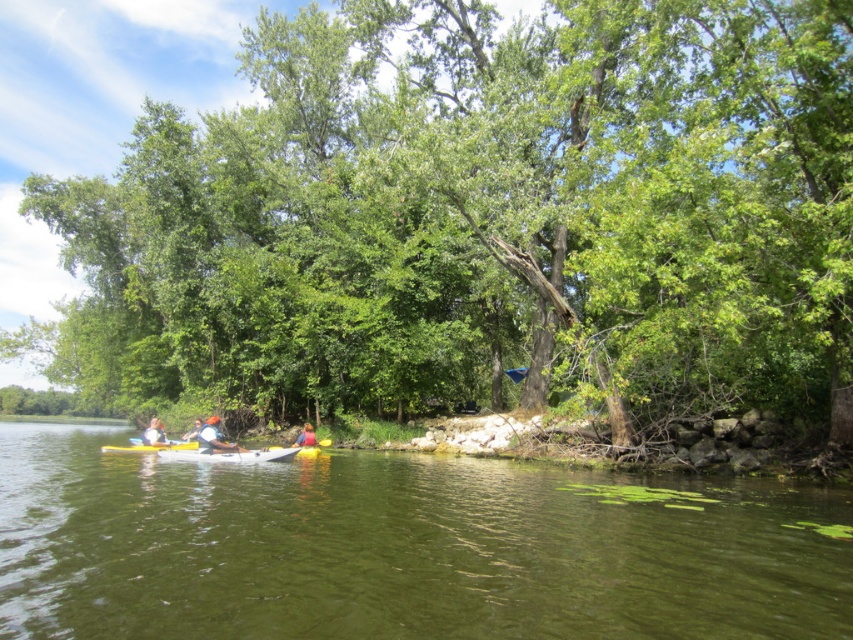
Which of these two, white fabric kayak at center or yellow plastic canoe at lower left, stands taller?

yellow plastic canoe at lower left

Can you confirm if white fabric kayak at center is positioned to the right of yellow plastic canoe at lower left?

Indeed, white fabric kayak at center is positioned on the right side of yellow plastic canoe at lower left.

The width and height of the screenshot is (853, 640). I want to click on white fabric kayak at center, so click(x=213, y=436).

Where is `white fabric kayak at center`? The image size is (853, 640). white fabric kayak at center is located at coordinates tap(213, 436).

Is white plastic kayak at lower center below white fabric kayak at center?

Correct, white plastic kayak at lower center is located below white fabric kayak at center.

Can you confirm if white plastic kayak at lower center is positioned above white fabric kayak at center?

No.

Between point (143, 444) and point (210, 433), which one is positioned behind?

Point (143, 444)

Find the location of `white plastic kayak at lower center`. white plastic kayak at lower center is located at coordinates (206, 452).

Measure the distance from yellow plastic canoe at lower left to yellow kayak at center.

5.40 meters

Does yellow plastic canoe at lower left appear on the right side of yellow kayak at center?

No, yellow plastic canoe at lower left is not to the right of yellow kayak at center.

Is point (175, 449) in front of point (305, 426)?

Yes, point (175, 449) is in front of point (305, 426).

This screenshot has width=853, height=640. In order to click on yellow plastic canoe at lower left in this screenshot , I will do `click(149, 448)`.